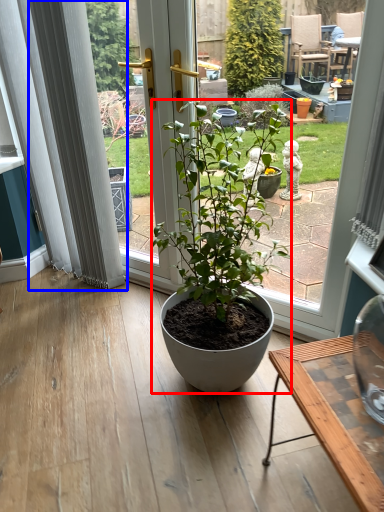
Question: Which point is closer to the camera, houseplant (highlighted by a red box) or curtain (highlighted by a blue box)?

Choices:
 (A) houseplant
 (B) curtain

Answer: (A)